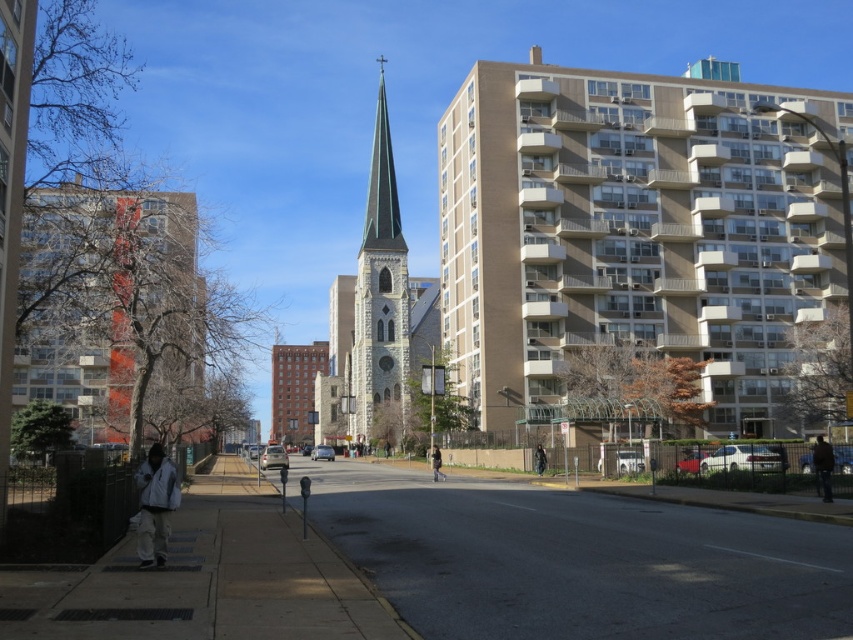
Question: Does gray stone church at center have a larger size compared to dark gray pants at center?

Choices:
 (A) yes
 (B) no

Answer: (A)

Question: Which object is positioned farthest from the gray stone church steeple at center?

Choices:
 (A) gray asphalt road at center
 (B) dark blue jacket at lower right
 (C) dark gray pants at center

Answer: (B)

Question: Which of these objects is positioned farthest from the gray stone spire at center?

Choices:
 (A) gray asphalt road at center
 (B) gray stone church steeple at center

Answer: (A)

Question: Is stone steeple at center below orange brick church at left?

Choices:
 (A) no
 (B) yes

Answer: (A)

Question: Which object is positioned farthest from the dark blue jacket at lower right?

Choices:
 (A) black leather jacket at lower center
 (B) gray stone church steeple at center
 (C) white fleece jacket at lower left
 (D) orange brick church at left

Answer: (B)

Question: Is orange brick church at left wider than gray stone spire at center?

Choices:
 (A) yes
 (B) no

Answer: (A)